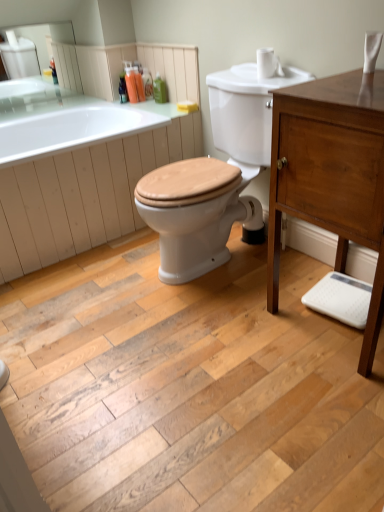
Identify the location of free space to the left of green plastic bottle at upper center, the 4th toiletry viewed from the left. (146, 102).